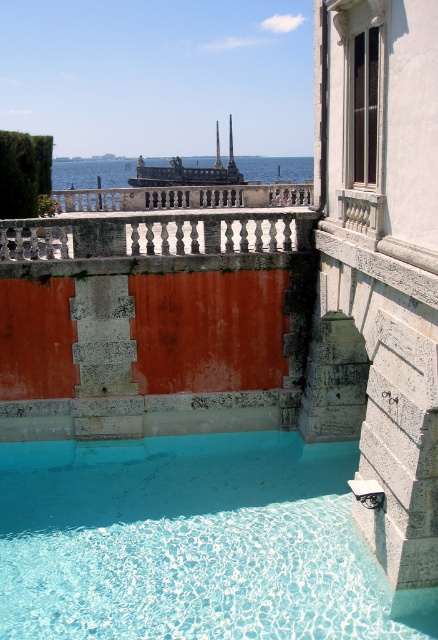
You are standing in the outdoor scene looking at the pool and the building. There are two points marked in the image. The first point is at coordinates point (321, 461) and the second is at point (155, 241). Which of these two points is closer to you?

Point (321, 461) is closer to the camera than point (155, 241).

You are standing at the edge of the pool and want to place a small decorative statue on the white stone balustrade at upper center so it can be seen from the blue water at center. Will the statue be visible from the water?

The white stone balustrade at upper center is not as tall as the blue water at center, so the statue placed on the balustrade will be visible from the water because the balustrade is lower than the water level.

You are standing at the edge of the pool and want to place a small floating decoration in the blue water at center. To ensure it stays in place, you need to know if the white stone balustrade at upper center is below or above the water. Based on the scene, can you determine this?

The white stone balustrade at upper center is positioned under the blue water at center, meaning it is below the water level. Therefore, placing the decoration there would keep it anchored by the balustrade.